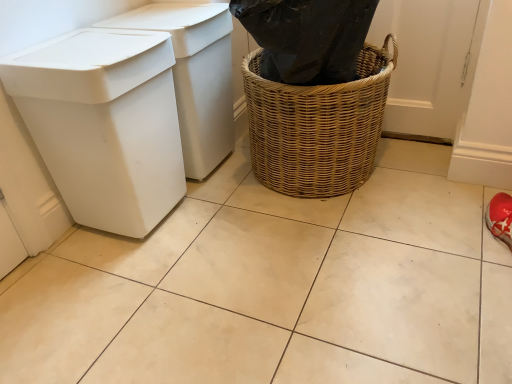
The width and height of the screenshot is (512, 384). I want to click on unoccupied region to the right of woven brown basket at center, so click(x=422, y=180).